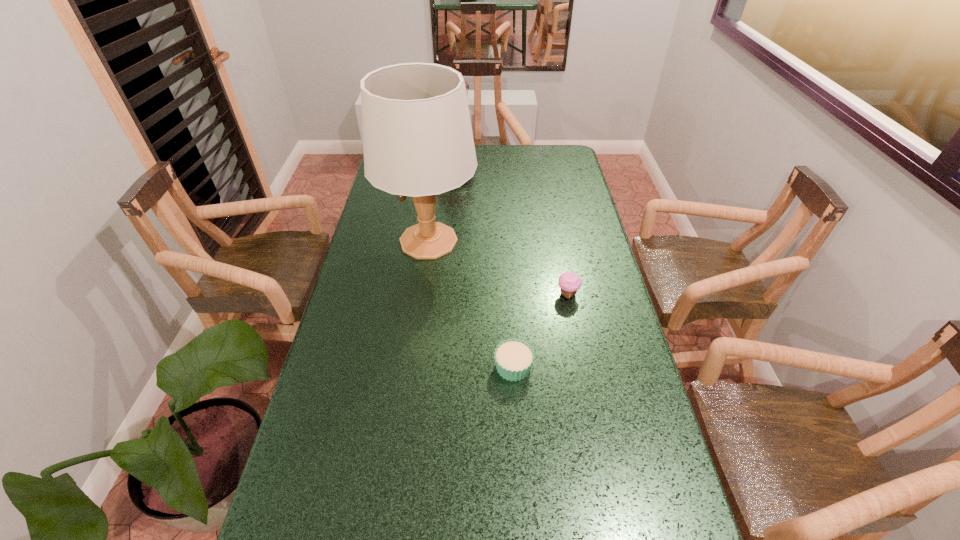
Identify the location of free space that is in between the taller cupcake and the nearer cupcake. This screenshot has width=960, height=540. (540, 330).

Where is `free point between the tallest object and the farther cupcake`? This screenshot has height=540, width=960. free point between the tallest object and the farther cupcake is located at coordinates (498, 268).

This screenshot has width=960, height=540. In order to click on free spot between the nearer cupcake and the food processor in this screenshot , I will do `click(484, 268)`.

This screenshot has height=540, width=960. I want to click on vacant region between the third farthest object and the third shortest object, so point(512,232).

Find the location of a particular element. Image resolution: width=960 pixels, height=540 pixels. free space that is in between the rightmost object and the third shortest object is located at coordinates (512, 232).

The height and width of the screenshot is (540, 960). I want to click on free space that is in between the table lamp and the shorter cupcake, so click(x=471, y=304).

Where is `vacant area between the farthest object and the third tallest object`? Image resolution: width=960 pixels, height=540 pixels. vacant area between the farthest object and the third tallest object is located at coordinates (512, 232).

This screenshot has width=960, height=540. Identify the location of vacant area that lies between the table lamp and the third shortest object. (442, 205).

The image size is (960, 540). Identify the location of vacant space in between the second farthest object and the taller cupcake. (498, 268).

This screenshot has height=540, width=960. Identify the location of object that is the nearest to the left cupcake. (569, 282).